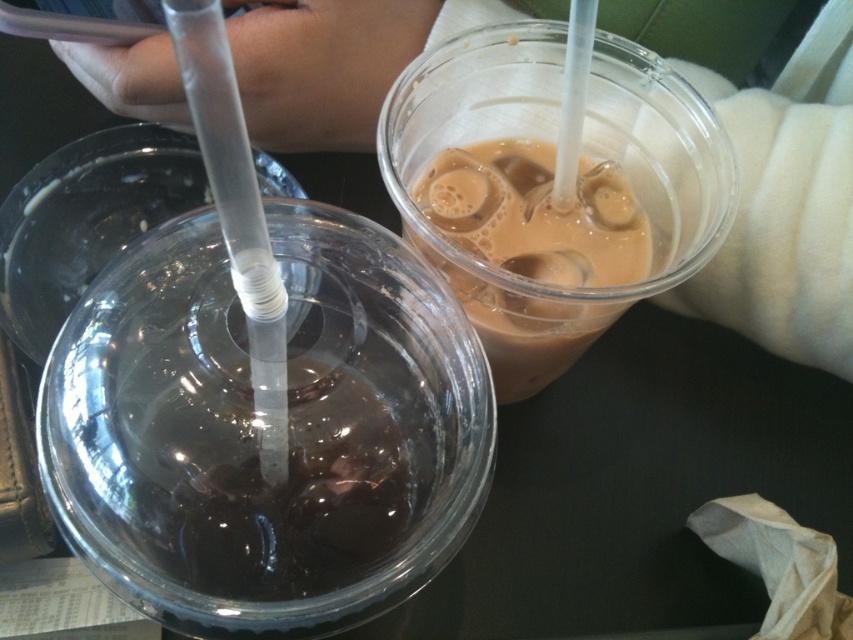
Between skinny white arm at upper center and brown matte plastic cup at upper right, which one is positioned higher?

skinny white arm at upper center

Based on the photo, does skinny white arm at upper center appear over brown matte plastic cup at upper right?

Indeed, skinny white arm at upper center is positioned over brown matte plastic cup at upper right.

Does point (706, 296) come behind point (556, 268)?

Yes, point (706, 296) is behind point (556, 268).

Where is `skinny white arm at upper center`? Image resolution: width=853 pixels, height=640 pixels. skinny white arm at upper center is located at coordinates (781, 227).